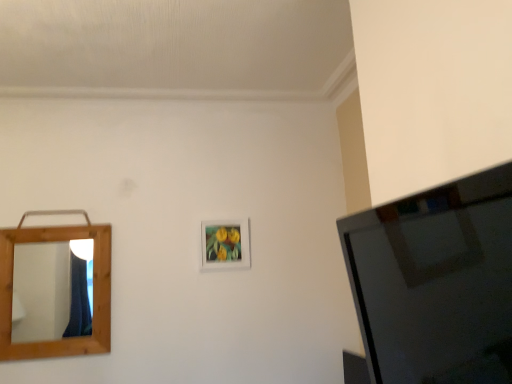
The image size is (512, 384). What do you see at coordinates (225, 244) in the screenshot?
I see `white matte picture frame at center` at bounding box center [225, 244].

What is the approximate width of white matte picture frame at center?

white matte picture frame at center is 1.10 inches wide.

The width and height of the screenshot is (512, 384). Identify the location of white matte picture frame at center. (225, 244).

At what (x,y) coordinates should I click in order to perform the action: click on white matte picture frame at center. Please return your answer as a coordinate pair (x, y). Image resolution: width=512 pixels, height=384 pixels. Looking at the image, I should click on (225, 244).